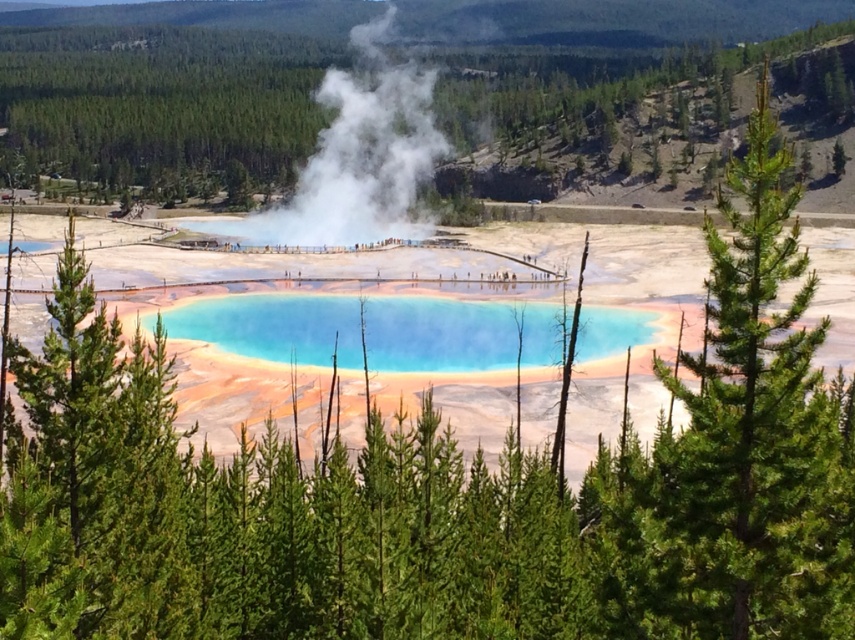
Can you confirm if green leafy tree at upper center is shorter than translucent blue water at center?

No, green leafy tree at upper center is not shorter than translucent blue water at center.

Who is positioned more to the right, green leafy tree at upper center or translucent blue water at center?

translucent blue water at center is more to the right.

Who is more forward, (711, 138) or (339, 323)?

Point (339, 323) is more forward.

This screenshot has width=855, height=640. What are the coordinates of `green leafy tree at upper center` in the screenshot? It's located at (600, 93).

From the picture: Which is more to the left, translucent blue water at center or white vapor at center?

white vapor at center

Is point (479, 348) behind point (426, 97)?

No.

Is point (588, 353) positioned in front of point (393, 224)?

Yes, it is in front of point (393, 224).

Image resolution: width=855 pixels, height=640 pixels. Find the location of `translucent blue water at center`. translucent blue water at center is located at coordinates (458, 333).

Is point (195, 136) farther from viewer compared to point (416, 156)?

Yes, point (195, 136) is behind point (416, 156).

Is green leafy tree at upper center taller than white vapor at center?

Correct, green leafy tree at upper center is much taller as white vapor at center.

Which is behind, point (148, 109) or point (255, 220)?

The point (148, 109) is behind.

Identify the location of green leafy tree at upper center. The height and width of the screenshot is (640, 855). click(600, 93).